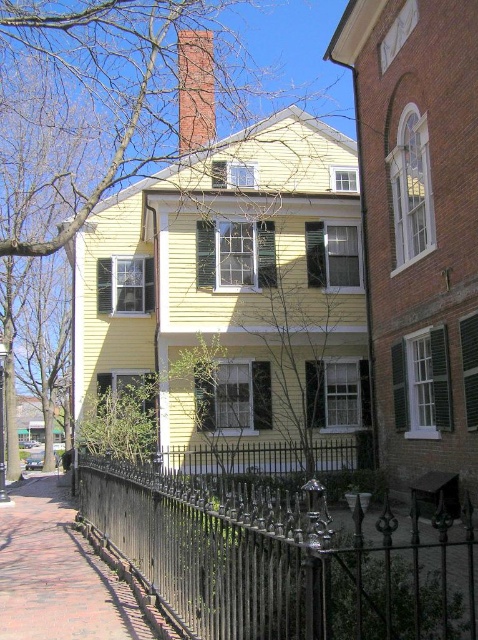
You are a painter hired to paint the house. You need to decide which object, the green leafy tree at upper left or the brick chimney at upper center, requires more paint because it has a larger surface area. Which one do you choose?

The green leafy tree at upper left requires more paint because it is bigger than the brick chimney at upper center.

You are standing at the point with coordinates point (207, 141) and want to walk to the point with coordinates point (86, 573). According to the scene, which direction should you face to move towards your destination?

You should face the direction towards the front of point (207, 141) since point (86, 573) is in front of it.